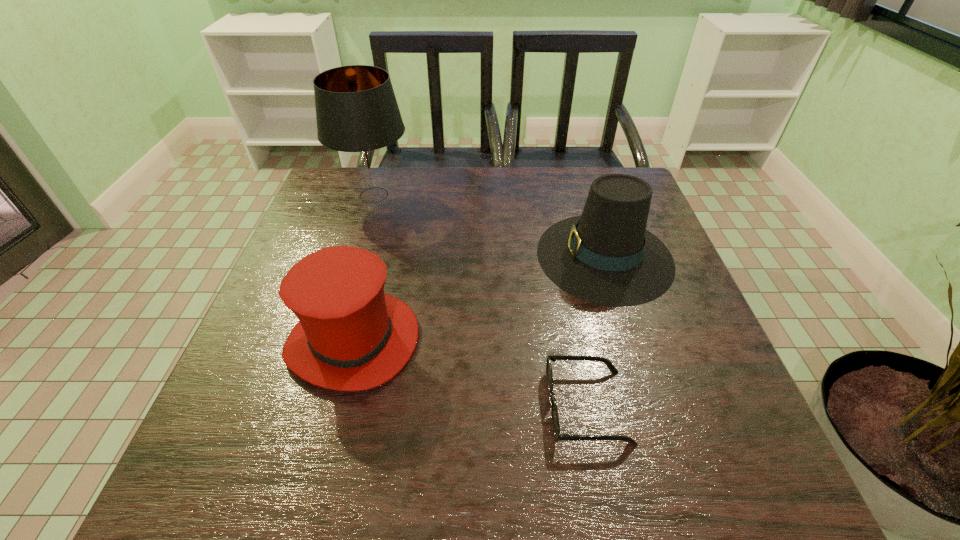
The height and width of the screenshot is (540, 960). In order to click on free spot between the shortest object and the right hat in this screenshot , I will do `click(596, 331)`.

Find the location of `free space between the right hat and the sunglasses`. free space between the right hat and the sunglasses is located at coordinates (596, 331).

At what (x,y) coordinates should I click in order to perform the action: click on vacant point located between the left hat and the sunglasses. Please return your answer as a coordinate pair (x, y). Looking at the image, I should click on (470, 373).

Identify the location of free space between the tallest object and the sunglasses. (481, 301).

Image resolution: width=960 pixels, height=540 pixels. I want to click on the closest object to the sunglasses, so click(x=606, y=256).

Select which object appears as the third closest to the left hat. Please provide its 2D coordinates. Your answer should be formatted as a tuple, i.e. [(x, y)], where the tuple contains the x and y coordinates of a point satisfying the conditions above.

[(357, 114)]